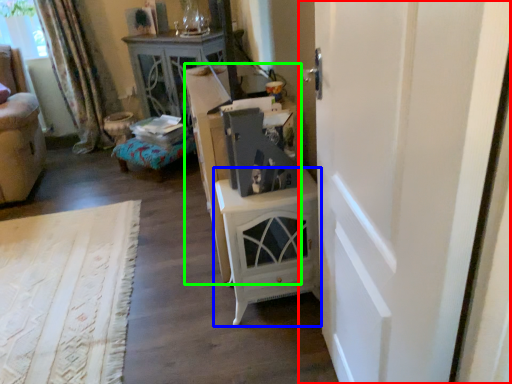
Question: Based on their relative distances, which object is farther from door (highlighted by a red box)? Choose from nightstand (highlighted by a blue box) and dresser (highlighted by a green box).

Choices:
 (A) nightstand
 (B) dresser

Answer: (B)